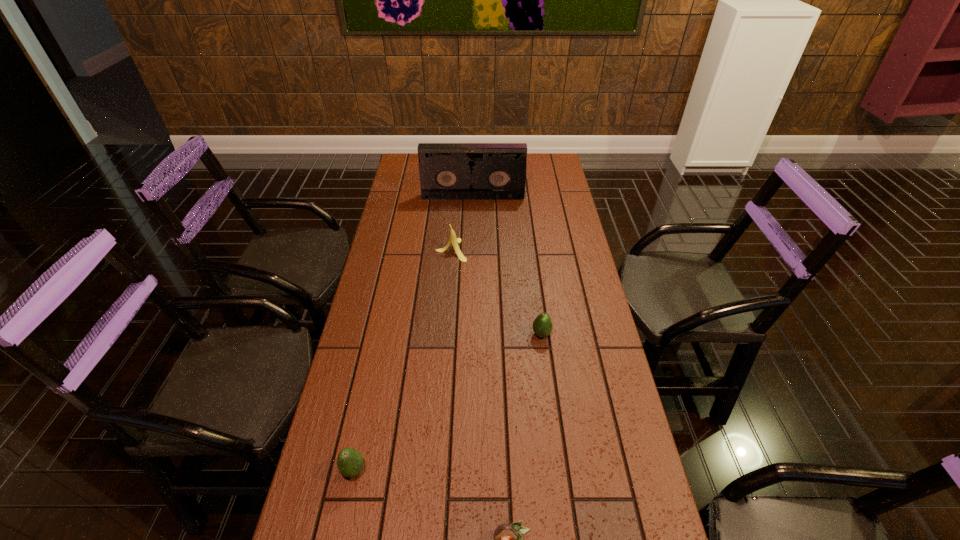
The image size is (960, 540). In order to click on the farthest object in this screenshot , I will do `click(448, 171)`.

Where is `videotape`? Image resolution: width=960 pixels, height=540 pixels. videotape is located at coordinates (448, 171).

You are a GUI agent. You are given a task and a screenshot of the screen. Output one action in this format:
    pyautogui.click(x=<x>, y=<y>)
    Task: Click on the banana
    
    Given the screenshot: What is the action you would take?
    pyautogui.click(x=453, y=240)

What are the coordinates of `the second farthest object` in the screenshot? It's located at (453, 240).

The height and width of the screenshot is (540, 960). What are the coordinates of `the second nearest object` in the screenshot? It's located at (350, 462).

The width and height of the screenshot is (960, 540). In order to click on the second nearest avocado in this screenshot , I will do `click(350, 462)`.

You are a GUI agent. You are given a task and a screenshot of the screen. Output one action in this format:
    pyautogui.click(x=<x>, y=<y>)
    Task: Click on the farthest avocado
    Image resolution: width=960 pixels, height=540 pixels.
    Given the screenshot: What is the action you would take?
    pyautogui.click(x=542, y=326)

Locate an element on the screen. The image size is (960, 540). the third farthest object is located at coordinates (542, 326).

The width and height of the screenshot is (960, 540). Find the location of `vacant area situated 0.050m on the front side of the tallest object`. vacant area situated 0.050m on the front side of the tallest object is located at coordinates (473, 206).

This screenshot has width=960, height=540. Find the location of `vacant point located on the right of the fourth shortest object`. vacant point located on the right of the fourth shortest object is located at coordinates (547, 250).